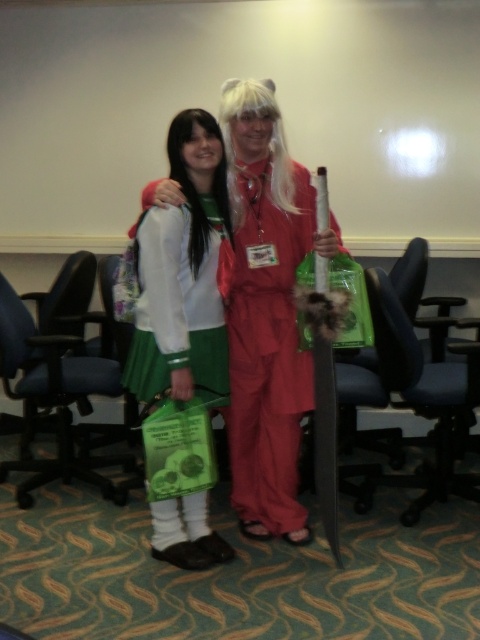
Question: Is green fabric skirt at center further to camera compared to white silky wig at center?

Choices:
 (A) yes
 (B) no

Answer: (B)

Question: Which of these objects is positioned farthest from the white silky wig at center?

Choices:
 (A) green fabric skirt at center
 (B) matte red jumpsuit at center

Answer: (A)

Question: Which object is positioned closest to the matte red jumpsuit at center?

Choices:
 (A) green fabric skirt at center
 (B) white silky wig at center

Answer: (A)

Question: Does green fabric skirt at center come in front of white silky wig at center?

Choices:
 (A) no
 (B) yes

Answer: (B)

Question: Does matte red jumpsuit at center appear on the right side of green fabric skirt at center?

Choices:
 (A) no
 (B) yes

Answer: (B)

Question: Which point appears farthest from the camera in this image?

Choices:
 (A) (259, 477)
 (B) (163, 243)

Answer: (A)